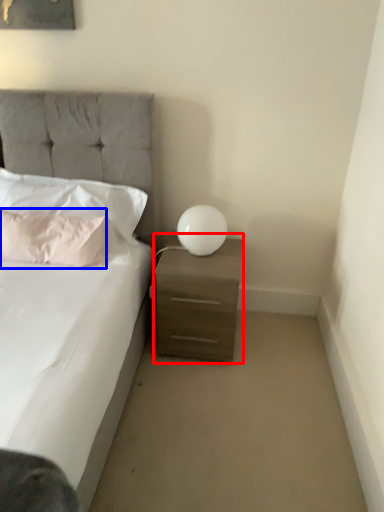
Question: Which object is closer to the camera taking this photo, nightstand (highlighted by a red box) or pillow (highlighted by a blue box)?

Choices:
 (A) nightstand
 (B) pillow

Answer: (A)